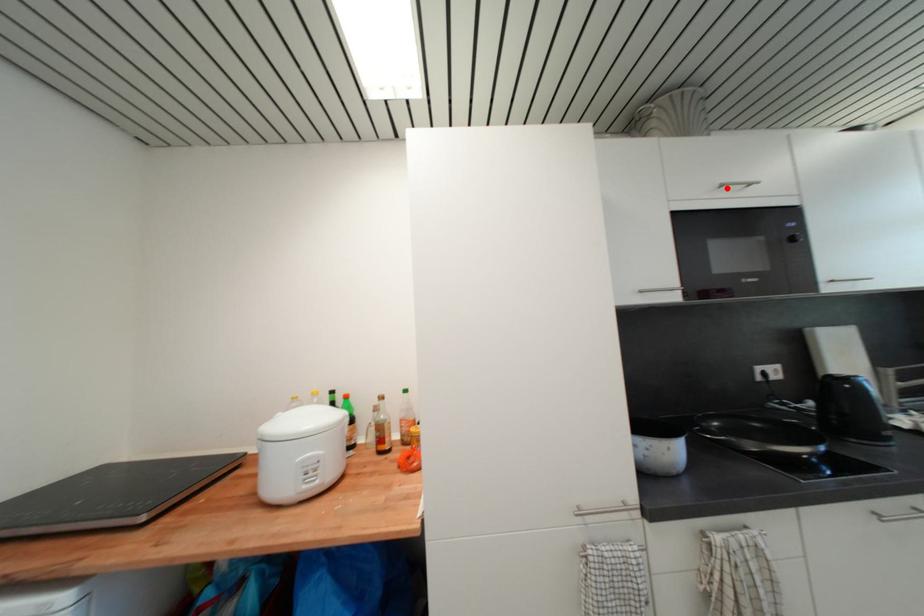
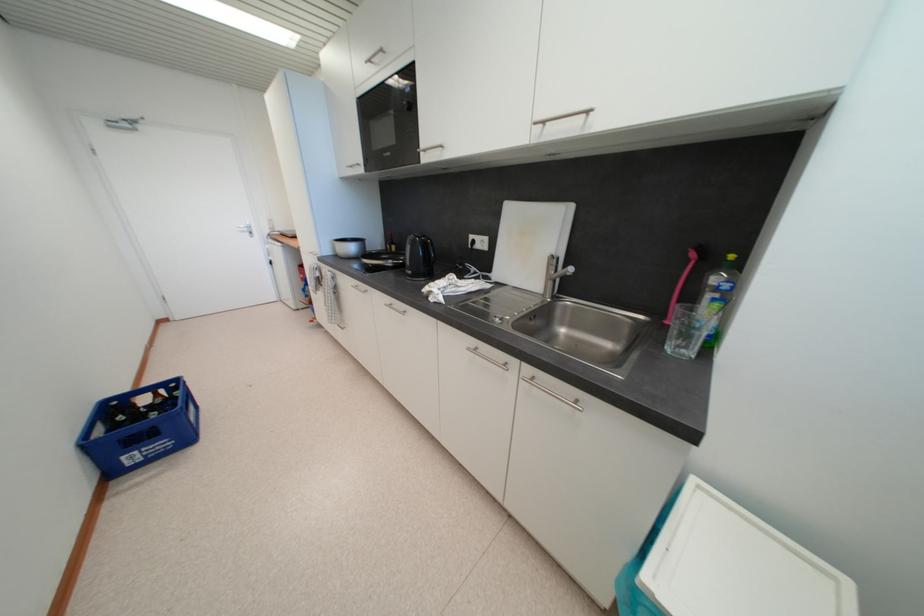
In the second image, find the point that corresponds to the highlighted location in the first image.

(375, 63)